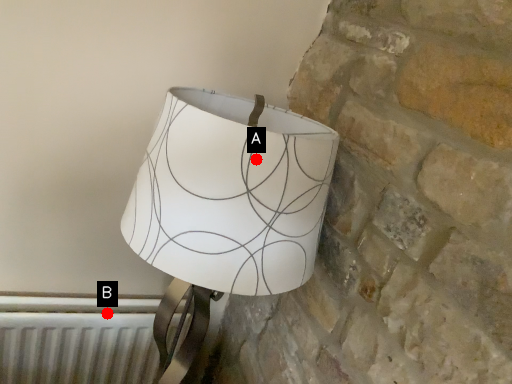
Question: Two points are circled on the image, labeled by A and B beside each circle. Which point is closer to the camera?

Choices:
 (A) A is closer
 (B) B is closer

Answer: (A)